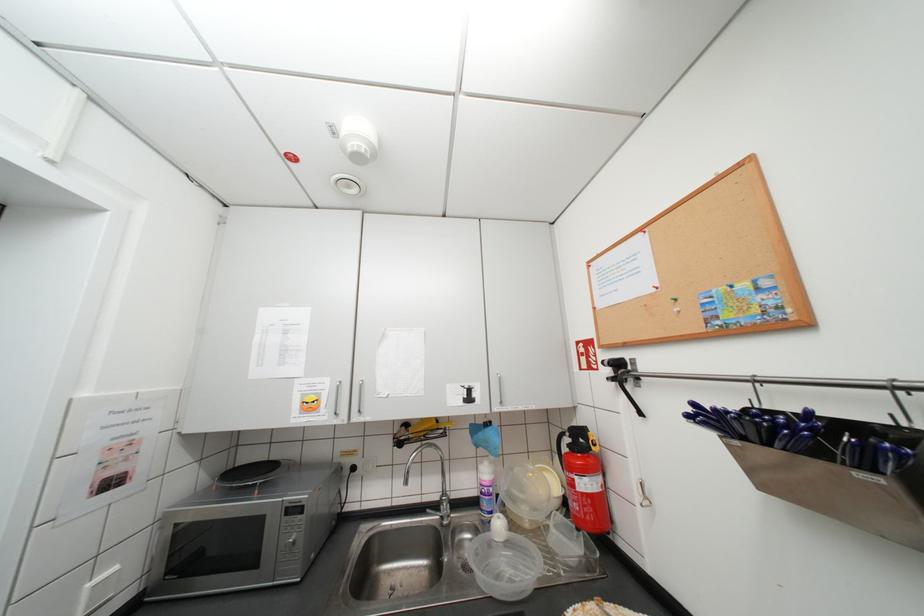
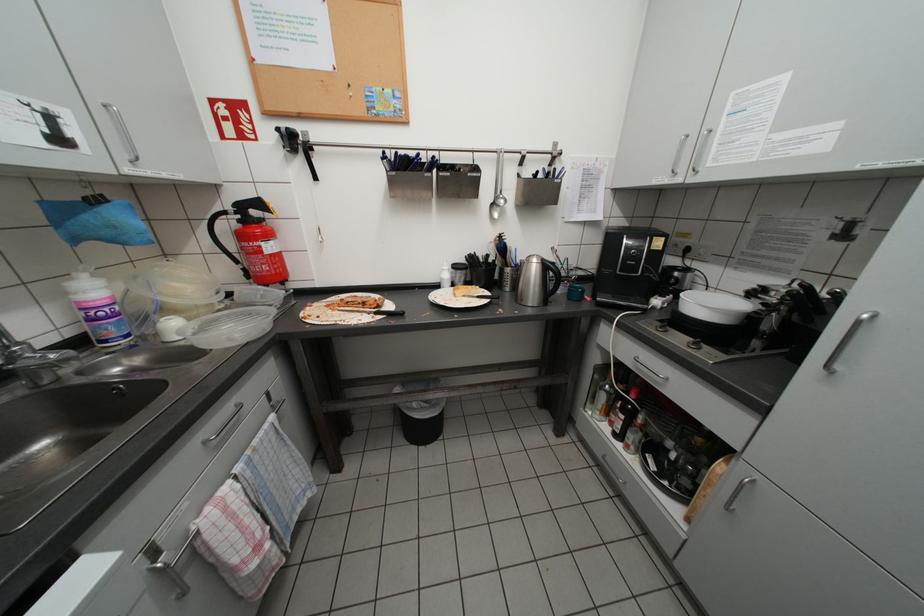
The images are taken continuously from a first-person perspective. In which direction is your viewpoint rotating?

The rotation direction of the camera is right-down.